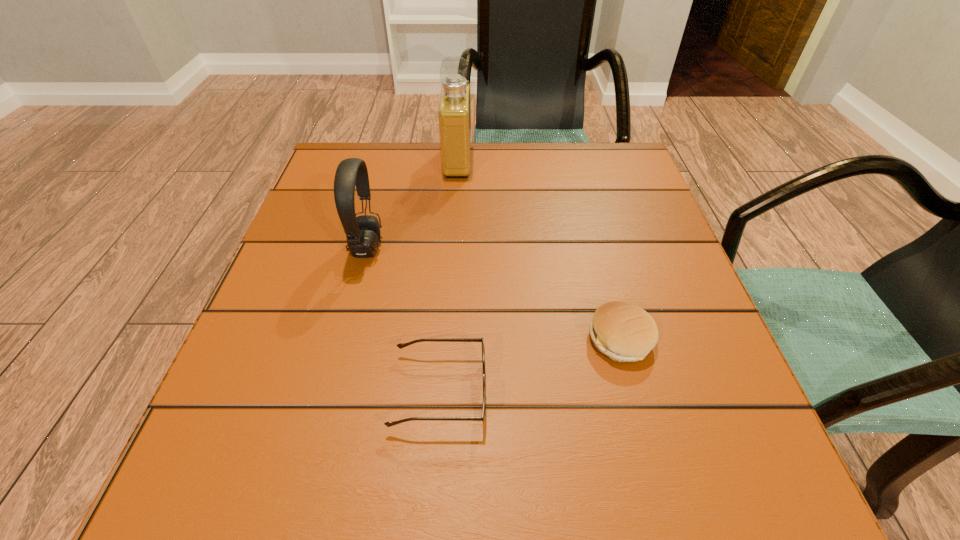
Identify the location of the farthest object. This screenshot has height=540, width=960. (454, 110).

At what (x,y) coordinates should I click in order to perform the action: click on perfume. Please return your answer as a coordinate pair (x, y). The image size is (960, 540). Looking at the image, I should click on [454, 110].

Identify the location of headset. (363, 235).

The image size is (960, 540). I want to click on the second farthest object, so click(x=363, y=235).

Image resolution: width=960 pixels, height=540 pixels. Find the location of `the rightmost object`. the rightmost object is located at coordinates (624, 332).

The width and height of the screenshot is (960, 540). What are the coordinates of `the second shortest object` in the screenshot? It's located at (624, 332).

Locate an element on the screen. Image resolution: width=960 pixels, height=540 pixels. sunglasses is located at coordinates (401, 345).

Identify the location of vacant space situated on the front-facing side of the farthest object. Image resolution: width=960 pixels, height=540 pixels. (604, 161).

Where is `blank space located on the front-facing side of the third nearest object`? The height and width of the screenshot is (540, 960). blank space located on the front-facing side of the third nearest object is located at coordinates (495, 247).

The width and height of the screenshot is (960, 540). I want to click on free spot located on the left of the rightmost object, so click(x=493, y=339).